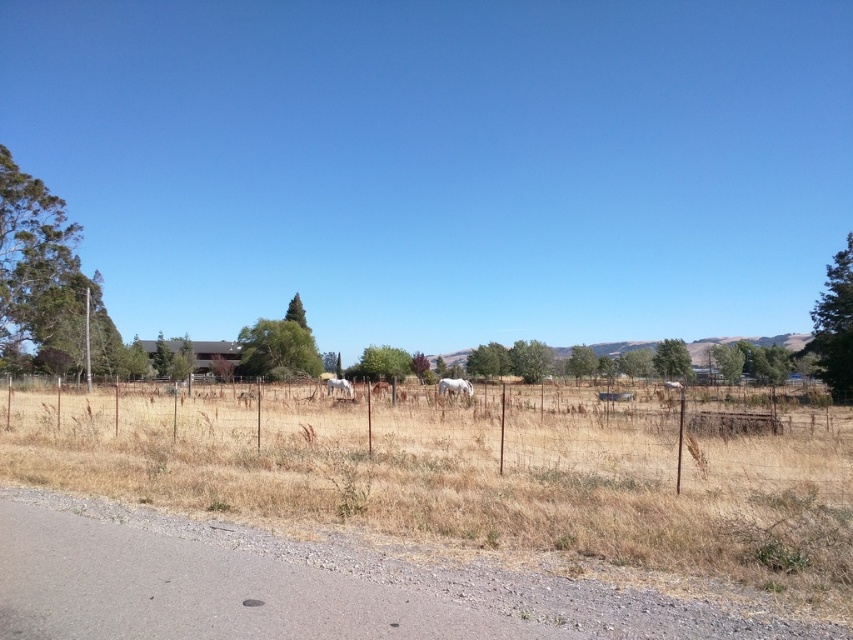
Question: Among these points, which one is nearest to the camera?

Choices:
 (A) (618, 544)
 (B) (445, 387)

Answer: (A)

Question: Is dry grass at center smaller than white matte horse at center?

Choices:
 (A) yes
 (B) no

Answer: (A)

Question: Which point appears farthest from the camera in this image?

Choices:
 (A) (351, 509)
 (B) (444, 390)

Answer: (B)

Question: Does dry grass at center appear over white glossy horse at center?

Choices:
 (A) yes
 (B) no

Answer: (A)

Question: Does dry grass at center appear over white matte horse at center?

Choices:
 (A) no
 (B) yes

Answer: (B)

Question: Which object appears farthest from the camera in this image?

Choices:
 (A) white matte horse at center
 (B) dry grass at center
 (C) white glossy horse at center

Answer: (C)